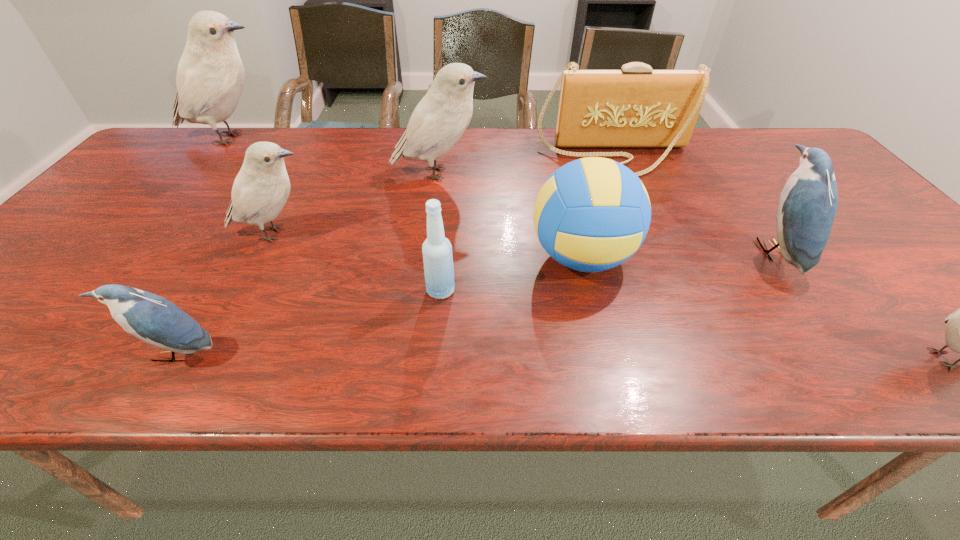
Where is `bottle`? The height and width of the screenshot is (540, 960). bottle is located at coordinates (437, 250).

At what (x,y) coordinates should I click in order to perform the action: click on the left blue bird. Please return your answer as a coordinate pair (x, y). Looking at the image, I should click on (153, 319).

Locate an element on the screen. The height and width of the screenshot is (540, 960). the smaller blue bird is located at coordinates (153, 319).

At what (x,y) coordinates should I click in order to perform the action: click on free space located 0.160m at the beak of the leftmost white bird. Please return your answer as a coordinate pair (x, y). Looking at the image, I should click on (333, 139).

Locate an element on the screen. vacant region located at the beak of the fifth nearest bird is located at coordinates (x=620, y=173).

Locate an element on the screen. Image resolution: width=960 pixels, height=540 pixels. free space located on the decorative side of the handbag is located at coordinates (631, 197).

This screenshot has height=540, width=960. Find the location of `vacant space situated 0.290m at the beak of the second smallest white bird`. vacant space situated 0.290m at the beak of the second smallest white bird is located at coordinates (441, 234).

At what (x,y) coordinates should I click in order to perform the action: click on vacant space located 0.110m at the tip of the second object from right to left's beak. Please return your answer as a coordinate pair (x, y). The image size is (960, 540). Looking at the image, I should click on (707, 251).

The height and width of the screenshot is (540, 960). I want to click on blank space located 0.310m at the tip of the second object from right to left's beak, so click(x=620, y=251).

The height and width of the screenshot is (540, 960). I want to click on vacant space located at the tip of the second object from right to left's beak, so click(650, 251).